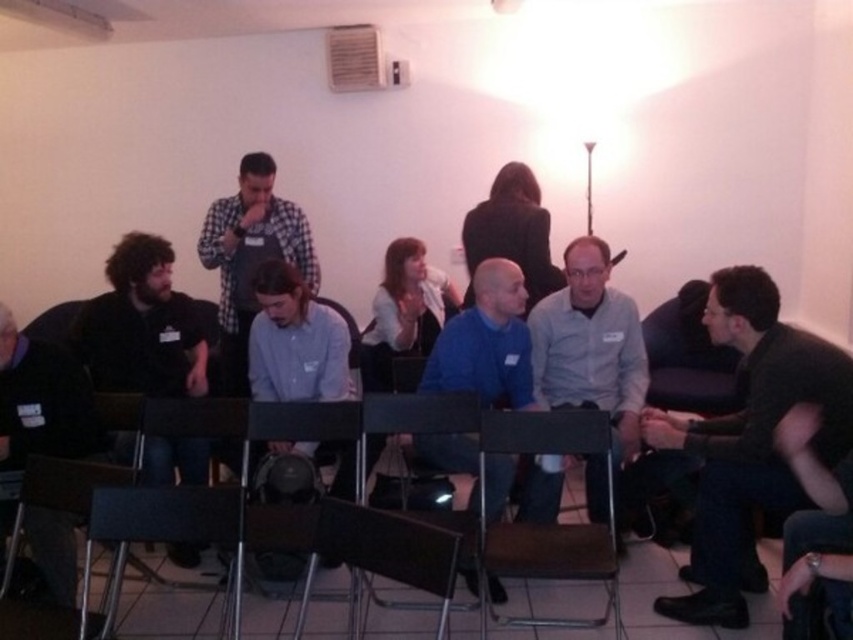
You are standing in the room and want to locate the dark gray sweater at center. According to the coordinates provided, where would you look relative to the room?

The dark gray sweater at center is located at coordinates point (749, 442), which would be in the lower right area of the room.

You are attending a meeting in this room and notice two items of interest. One is the dark gray sweater at center and the other is the metallic gray chair at center. Which of these items is positioned higher relative to the other?

The dark gray sweater at center is located above the metallic gray chair at center, so it is positioned higher.